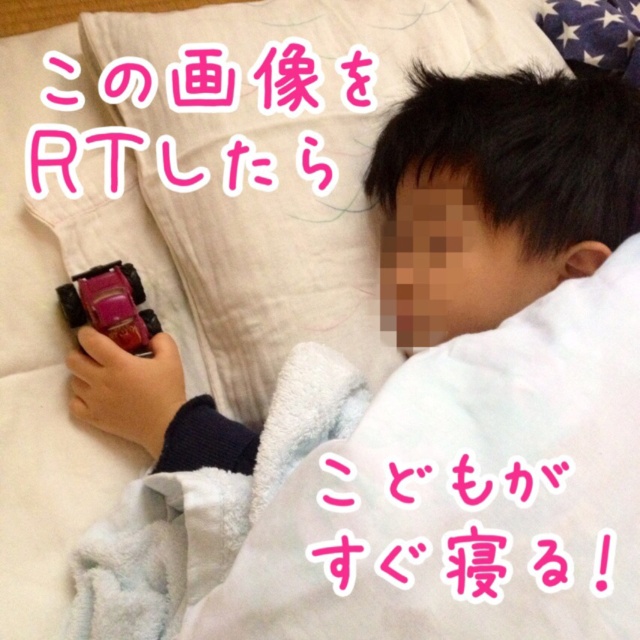
Is smooth skin face at upper right above shiny red car at lower left?

Yes.

Can you confirm if smooth skin face at upper right is smaller than shiny red car at lower left?

Actually, smooth skin face at upper right might be larger than shiny red car at lower left.

Is point (392, 148) behind point (77, 284)?

No, it is not.

This screenshot has height=640, width=640. I want to click on smooth skin face at upper right, so click(x=500, y=193).